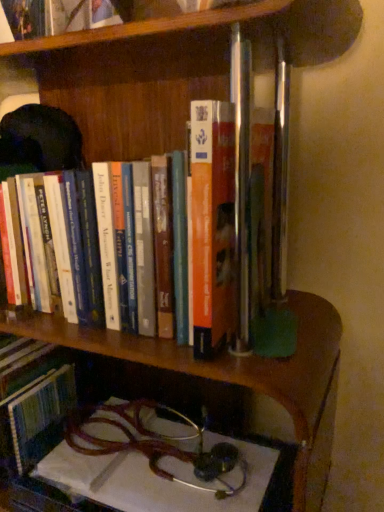
Locate an element on the screen. This screenshot has height=512, width=384. vacant space behind hardcover book at upper center, which is the first book in top-to-bottom order is located at coordinates (114, 64).